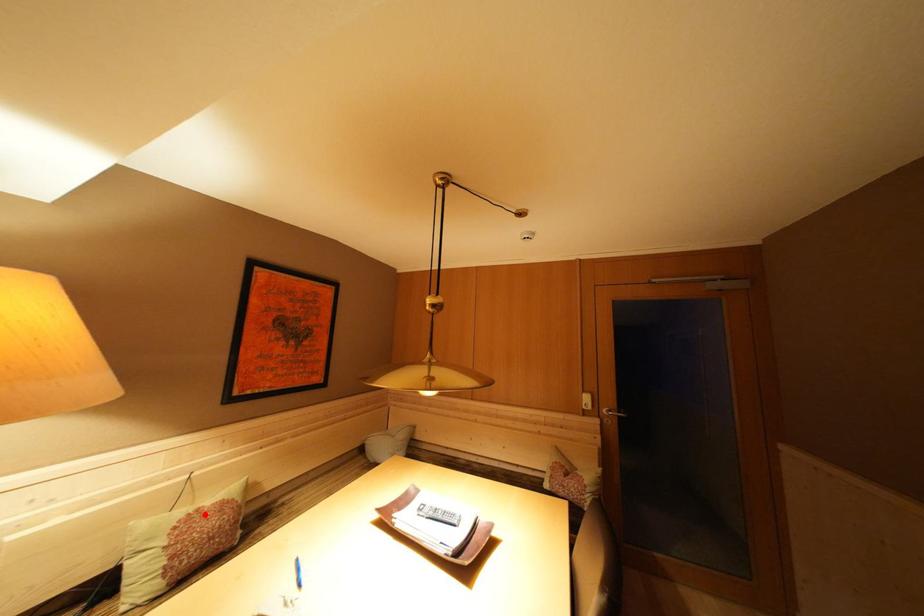
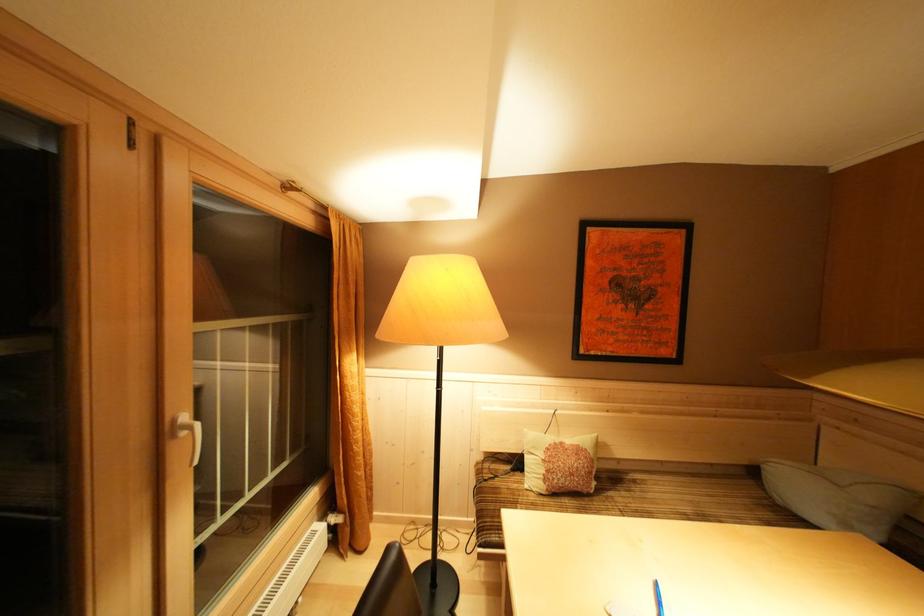
Question: I am providing you with two images of the same scene from different viewpoints. In image1, a red point is highlighted. Considering the same 3D point in image2, which of the following is correct?

Choices:
 (A) It is closer
 (B) It is farther

Answer: (B)